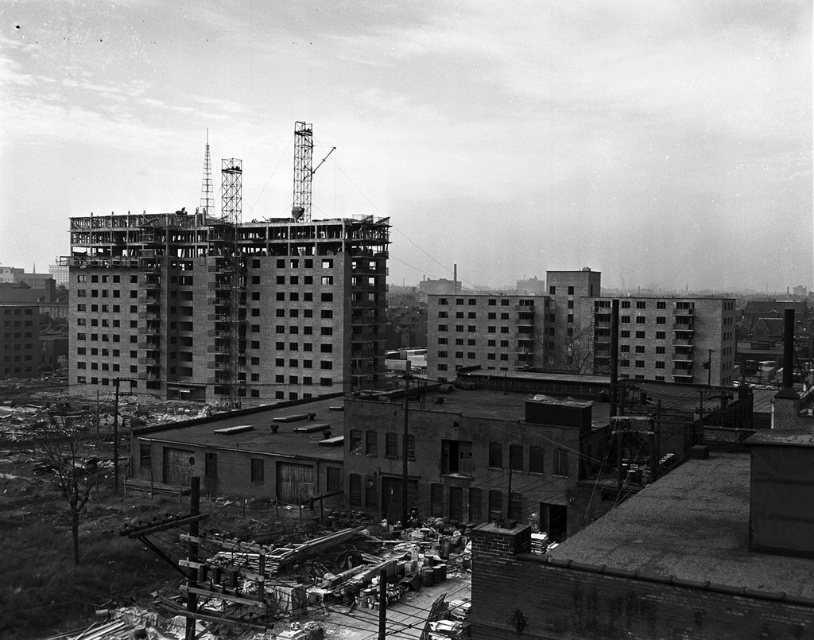
You are a construction worker who needs to place a heavy equipment on the exposed concrete foundation at center. However, there is an exposed concrete building at center nearby. Based on the scene description, can you safely place the equipment on the foundation without it being obstructed by the building?

The exposed concrete foundation at center is positioned under the exposed concrete building at center, so placing heavy equipment on the foundation may be obstructed by the building above it. Choose another location for the equipment.

You are a surveyor standing at the construction site. You need to determine which of the two points, point [270,426] or point [278,349], is closer to you. Based on the image, which point is nearer?

Point [270,426] is closer to the camera than point [278,349], so the point nearer to you is point [270,426].